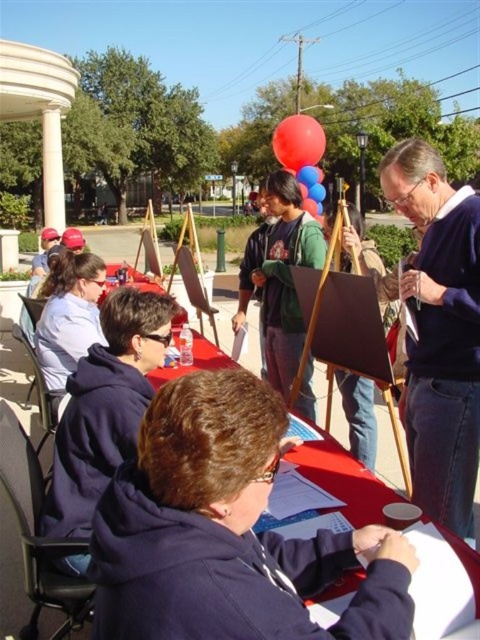
Which of these two, green fleece jacket at center or rubberized glossy balloon at upper center, stands shorter?

With less height is green fleece jacket at center.

Between green fleece jacket at center and rubberized glossy balloon at upper center, which one appears on the right side from the viewer's perspective?

Positioned to the right is rubberized glossy balloon at upper center.

Where is `green fleece jacket at center`? The width and height of the screenshot is (480, 640). green fleece jacket at center is located at coordinates (280, 275).

At what (x,y) coordinates should I click in order to perform the action: click on green fleece jacket at center. Please return your answer as a coordinate pair (x, y). The image size is (480, 640). Looking at the image, I should click on (280, 275).

I want to click on matte blue sweater at right, so click(x=440, y=333).

Between point (408, 273) and point (308, 134), which one is positioned behind?

The point (308, 134) is more distant.

Is point (414, 154) positioned behind point (287, 140)?

No, it is not.

Identify the location of matte blue sweater at right. The image size is (480, 640). (440, 333).

Describe the element at coordinates (440, 333) in the screenshot. The height and width of the screenshot is (640, 480). I see `matte blue sweater at right` at that location.

At what (x,y) coordinates should I click in order to perform the action: click on matte blue sweater at right. Please return your answer as a coordinate pair (x, y). The width and height of the screenshot is (480, 640). Looking at the image, I should click on (440, 333).

Who is more forward, (477, 298) or (283, 275)?

→ Point (477, 298) is in front.

Locate an element on the screen. This screenshot has width=480, height=640. matte blue sweater at right is located at coordinates (440, 333).